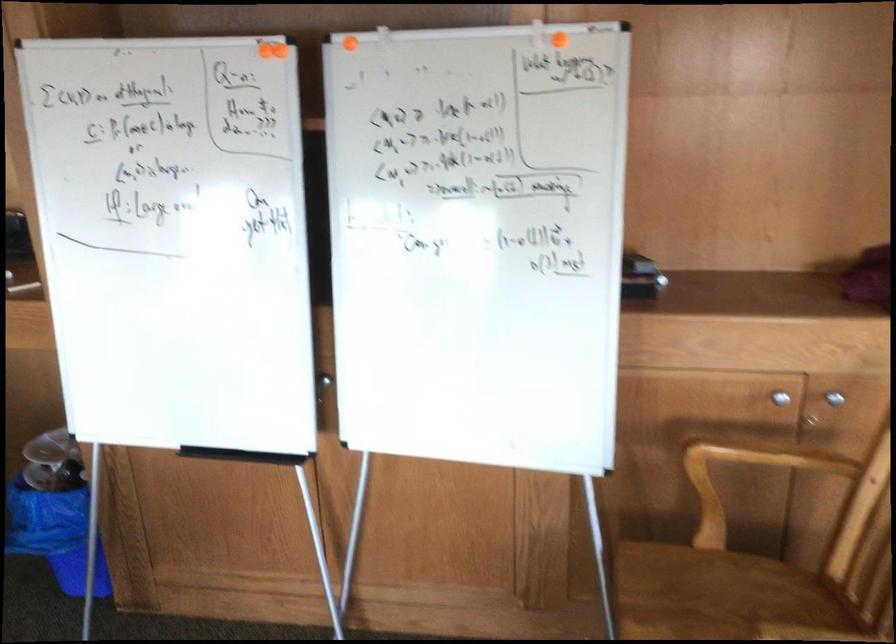
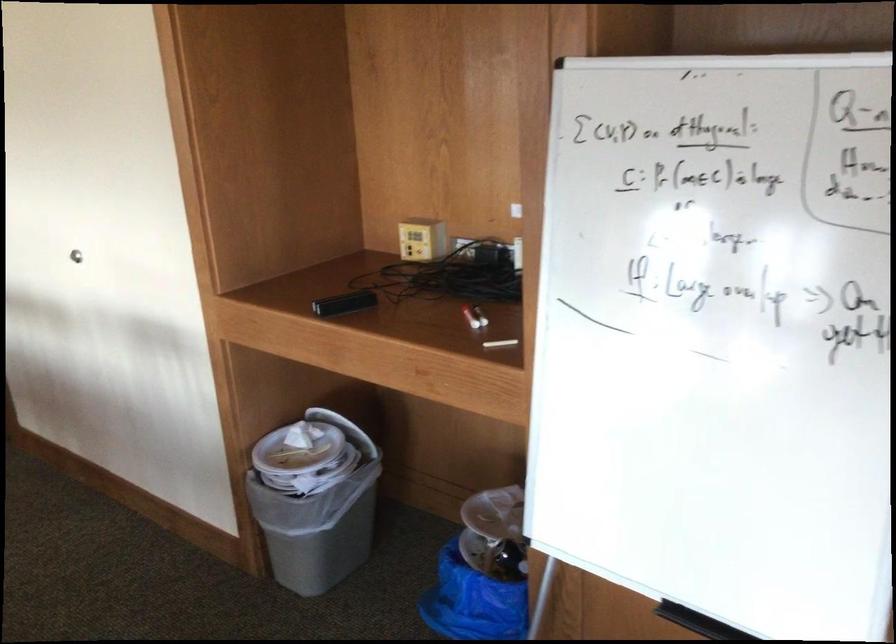
The images are taken continuously from a first-person perspective. In which direction are you moving?

The cameraman moved toward left, forward.